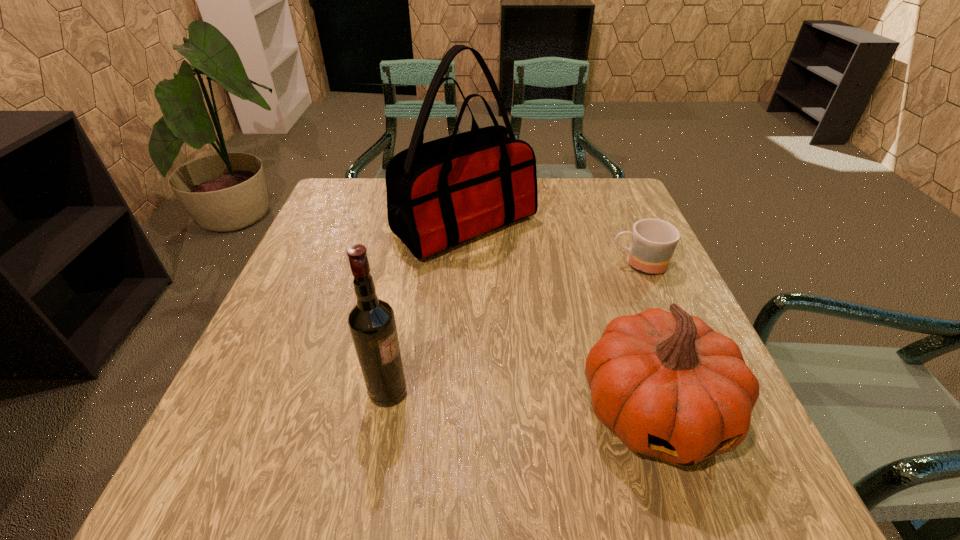
What are the coordinates of `free point between the shortest object and the duffel bag` in the screenshot? It's located at (552, 244).

Locate an element on the screen. The width and height of the screenshot is (960, 540). unoccupied area between the third tallest object and the tallest object is located at coordinates (x=559, y=318).

Find the location of `empty location between the mug and the wine bottle`. empty location between the mug and the wine bottle is located at coordinates (514, 327).

This screenshot has width=960, height=540. I want to click on free space between the mug and the tallest object, so click(x=552, y=244).

Locate an element on the screen. empty location between the shortest object and the tallest object is located at coordinates (552, 244).

Find the location of a particular element. free space between the second tallest object and the pumpkin is located at coordinates (520, 401).

Image resolution: width=960 pixels, height=540 pixels. Identify the location of vacant area between the duffel bag and the mug. (552, 244).

Locate which object ranks in proximity to the wine bottle. Please provide its 2D coordinates. Your answer should be formatted as a tuple, i.e. [(x, y)], where the tuple contains the x and y coordinates of a point satisfying the conditions above.

[(669, 386)]

Select which object appears as the second closest to the second tallest object. Please provide its 2D coordinates. Your answer should be formatted as a tuple, i.e. [(x, y)], where the tuple contains the x and y coordinates of a point satisfying the conditions above.

[(440, 193)]

This screenshot has width=960, height=540. What are the coordinates of `vacant space that satisfies the following two spatial constraints: 1. on the side with the handle of the mug; 2. on the face of the second shortest object` in the screenshot? It's located at (702, 411).